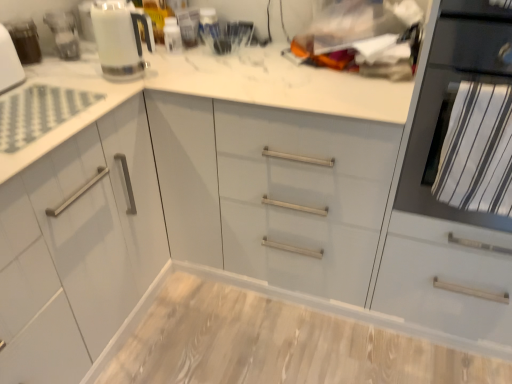
What are the coordinates of `vacant space situated on the left part of white glossy kettle at upper left` in the screenshot? It's located at (82, 66).